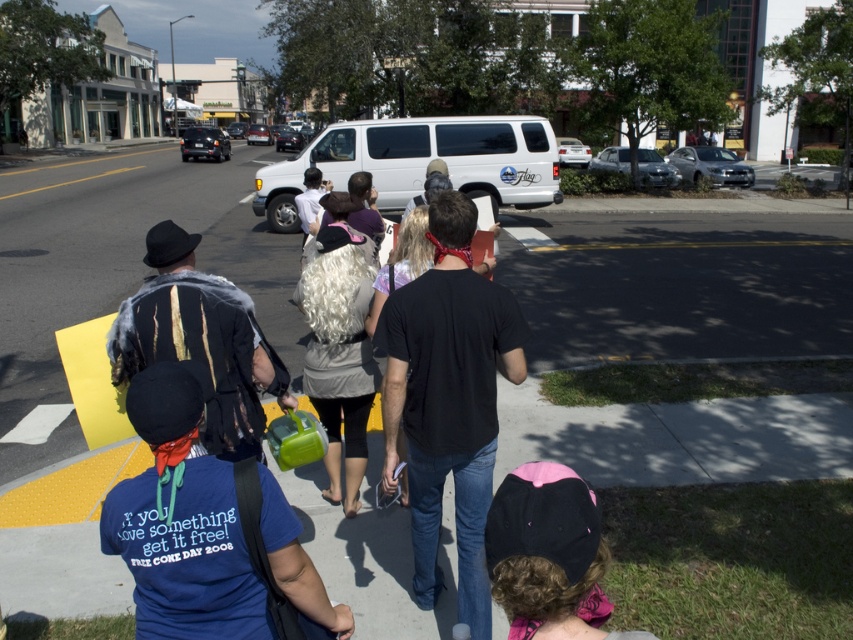
Based on the scene description, which object is smaller in size between the white curly wig at center and the shiny black sedan at center?

The white curly wig at center is smaller than the shiny black sedan at center.